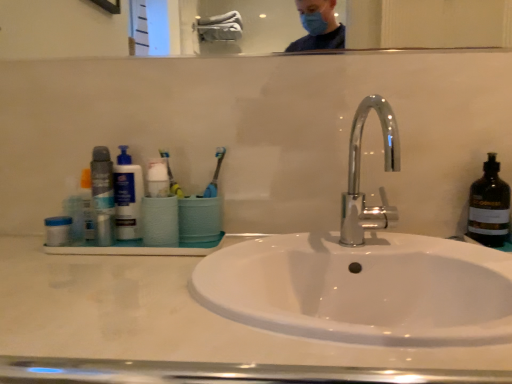
Where is `unoccupied area in front of matte plastic bottle at left`? unoccupied area in front of matte plastic bottle at left is located at coordinates (97, 264).